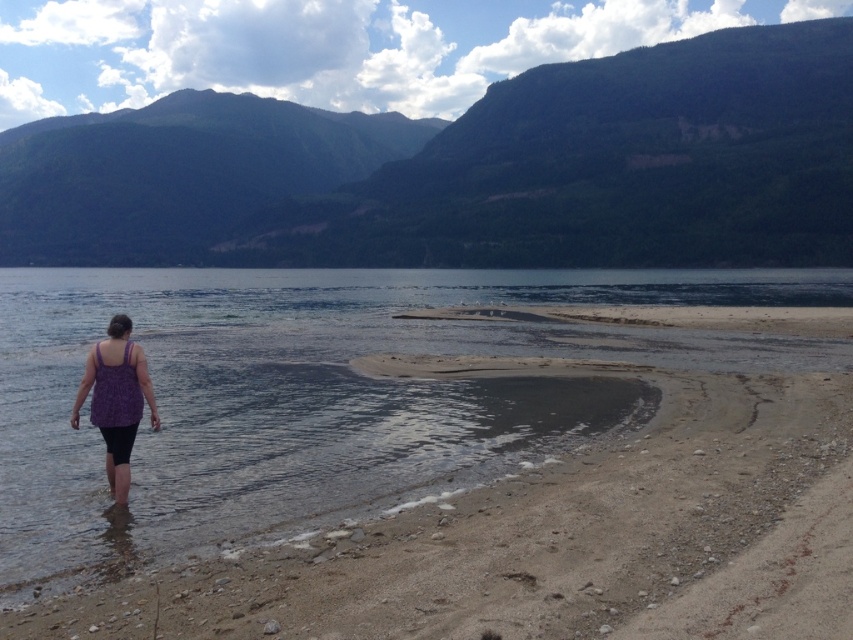
Question: Can you confirm if green forested mountain at upper center is bigger than purple fabric tank top at lower left?

Choices:
 (A) no
 (B) yes

Answer: (B)

Question: Observing the image, what is the correct spatial positioning of green forested mountain at upper center in reference to purple fabric tank top at lower left?

Choices:
 (A) left
 (B) right

Answer: (A)

Question: Which of these objects is positioned closest to the purple fabric tank top at lower left?

Choices:
 (A) green forested mountain at upper center
 (B) sandy beach at lower left

Answer: (B)

Question: Can you confirm if green forested mountain at upper center is positioned above purple fabric tank top at lower left?

Choices:
 (A) yes
 (B) no

Answer: (A)

Question: Among these objects, which one is farthest from the camera?

Choices:
 (A) purple fabric tank top at lower left
 (B) sandy beach at lower left

Answer: (A)

Question: Which of the following is the farthest from the observer?

Choices:
 (A) (355, 566)
 (B) (126, 320)
 (C) (454, 129)

Answer: (C)